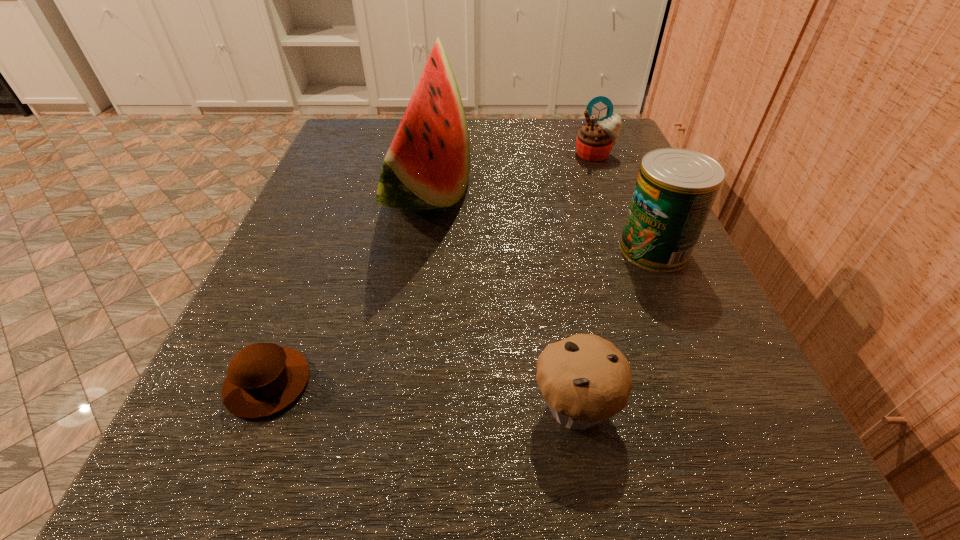
Choose which object is the third nearest neighbor to the rightmost muffin. Please provide its 2D coordinates. Your answer should be formatted as a tuple, i.e. [(x, y)], where the tuple contains the x and y coordinates of a point satisfying the conditions above.

[(585, 379)]

Identify the location of muffin that can be found as the second closest to the farthest muffin. The height and width of the screenshot is (540, 960). pos(263,379).

At what (x,y) coordinates should I click in order to perform the action: click on muffin that stands as the second closest to the farthest muffin. Please return your answer as a coordinate pair (x, y). This screenshot has width=960, height=540. Looking at the image, I should click on (263, 379).

Locate an element on the screen. This screenshot has width=960, height=540. vacant space that satisfies the following two spatial constraints: 1. on the outer rind of the second shortest muffin; 2. on the right side of the watermelon is located at coordinates (396, 407).

At what (x,y) coordinates should I click in order to perform the action: click on blank area in the image that satisfies the following two spatial constraints: 1. on the front-facing side of the can; 2. on the right side of the third tallest object. Please return your answer as a coordinate pair (x, y). Looking at the image, I should click on (631, 249).

Locate an element on the screen. blank space that satisfies the following two spatial constraints: 1. on the outer rind of the tallest object; 2. on the right side of the can is located at coordinates (420, 249).

Identify the location of blank space that satisfies the following two spatial constraints: 1. on the back side of the second shortest muffin; 2. on the outer rind of the watermelon. (538, 191).

The width and height of the screenshot is (960, 540). I want to click on blank space that satisfies the following two spatial constraints: 1. on the outer rind of the tallest object; 2. on the front side of the leftmost muffin, so click(x=400, y=383).

The width and height of the screenshot is (960, 540). I want to click on vacant space that satisfies the following two spatial constraints: 1. on the front-facing side of the farthest muffin; 2. on the right side of the fourth shortest object, so click(x=631, y=249).